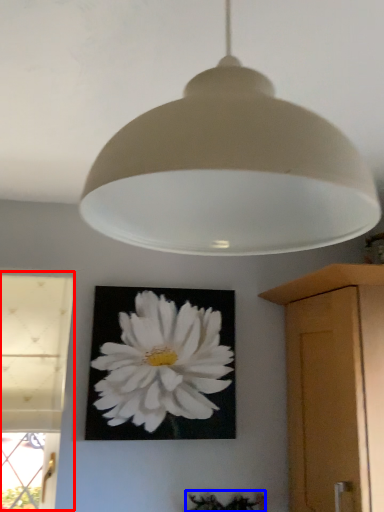
Question: Which point is closer to the camera, window (highlighted by a red box) or plant (highlighted by a blue box)?

Choices:
 (A) window
 (B) plant

Answer: (A)